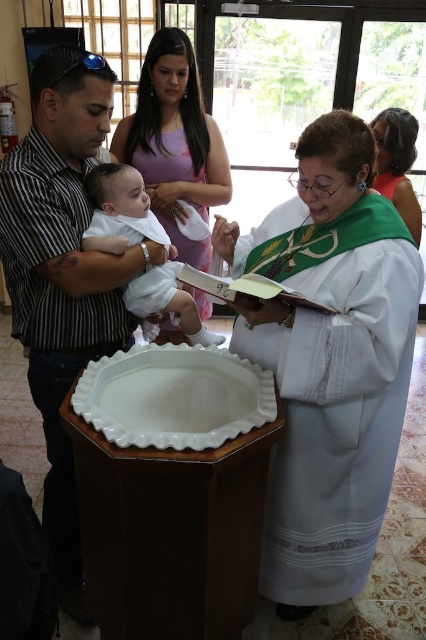
How much distance is there between white cloth robe at center and matte black shirt at left?

65.01 centimeters

From the picture: Which is above, white cloth robe at center or matte black shirt at left?

matte black shirt at left is above.

This screenshot has height=640, width=426. Describe the element at coordinates (331, 388) in the screenshot. I see `white cloth robe at center` at that location.

Where is `white cloth robe at center`? The image size is (426, 640). white cloth robe at center is located at coordinates (x=331, y=388).

Does white glossy tray at center come behind white clothed baby at center?

No.

Consider the image. Is white glossy tray at center to the left of white clothed baby at center from the viewer's perspective?

In fact, white glossy tray at center is to the right of white clothed baby at center.

Who is more distant from viewer, (207, 371) or (86, 241)?

Point (207, 371)

Image resolution: width=426 pixels, height=640 pixels. Find the location of `white glossy tray at center`. white glossy tray at center is located at coordinates (173, 396).

Between matte pink dress at upper center and white clothed baby at center, which one is positioned lower?

Result: white clothed baby at center is below.

Measure the distance between matte pink dress at upper center and white clothed baby at center.

matte pink dress at upper center is 21.39 inches from white clothed baby at center.

Between point (157, 170) and point (97, 193), which one is positioned behind?

The point (157, 170) is behind.

Image resolution: width=426 pixels, height=640 pixels. What are the coordinates of `matte pink dress at upper center` in the screenshot? It's located at (175, 141).